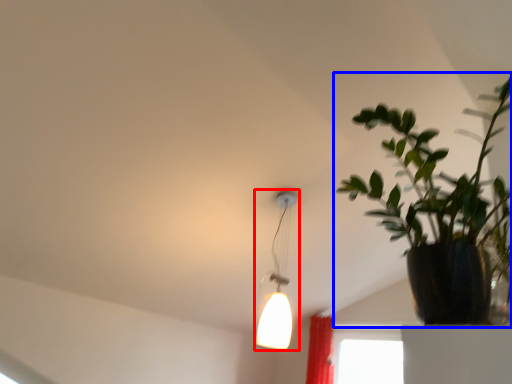
Question: Which object is further to the camera taking this photo, lamp (highlighted by a red box) or houseplant (highlighted by a blue box)?

Choices:
 (A) lamp
 (B) houseplant

Answer: (A)